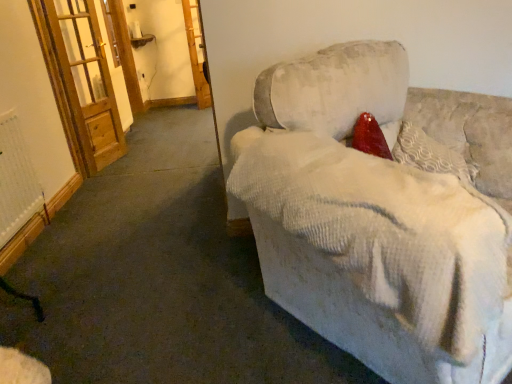
Question: From the image's perspective, is textured cream pillow at upper right above white textured radiator at lower left?

Choices:
 (A) no
 (B) yes

Answer: (B)

Question: Can you confirm if textured cream pillow at upper right is positioned to the right of white textured radiator at lower left?

Choices:
 (A) yes
 (B) no

Answer: (A)

Question: Is textured cream pillow at upper right far from white textured radiator at lower left?

Choices:
 (A) no
 (B) yes

Answer: (B)

Question: Is the position of textured cream pillow at upper right less distant than that of white textured radiator at lower left?

Choices:
 (A) yes
 (B) no

Answer: (A)

Question: Can you confirm if textured cream pillow at upper right is thinner than white textured radiator at lower left?

Choices:
 (A) yes
 (B) no

Answer: (B)

Question: Is white textured radiator at lower left to the left or to the right of wooden screen door at left, the second screen door viewed from the right, in the image?

Choices:
 (A) right
 (B) left

Answer: (A)

Question: Considering the positions of white textured radiator at lower left and wooden screen door at left, the second screen door viewed from the right, in the image, is white textured radiator at lower left bigger or smaller than wooden screen door at left, the second screen door viewed from the right,?

Choices:
 (A) big
 (B) small

Answer: (B)

Question: Is white textured radiator at lower left in front of or behind wooden screen door at left, the second screen door viewed from the right, in the image?

Choices:
 (A) behind
 (B) front

Answer: (B)

Question: From a real-world perspective, is white textured radiator at lower left positioned above or below wooden screen door at left, positioned as the first screen door in front-to-back order?

Choices:
 (A) below
 (B) above

Answer: (A)

Question: Considering their positions, is wooden screen door at upper left, marked as the first screen door in a right-to-left arrangement, located in front of or behind white textured radiator at lower left?

Choices:
 (A) front
 (B) behind

Answer: (B)

Question: In the image, is wooden screen door at upper left, the 2th screen door from the front, on the left side or the right side of white textured radiator at lower left?

Choices:
 (A) right
 (B) left

Answer: (A)

Question: Would you say wooden screen door at upper left, which is counted as the second screen door, starting from the left, is inside or outside white textured radiator at lower left?

Choices:
 (A) inside
 (B) outside

Answer: (B)

Question: From their relative heights in the image, would you say wooden screen door at upper left, which is counted as the second screen door, starting from the left, is taller or shorter than white textured radiator at lower left?

Choices:
 (A) tall
 (B) short

Answer: (A)

Question: Is point (94, 69) positioned closer to the camera than point (429, 139)?

Choices:
 (A) farther
 (B) closer

Answer: (A)

Question: Considering their positions, is wooden screen door at left, positioned as the first screen door in front-to-back order, located in front of or behind textured cream pillow at upper right?

Choices:
 (A) behind
 (B) front

Answer: (A)